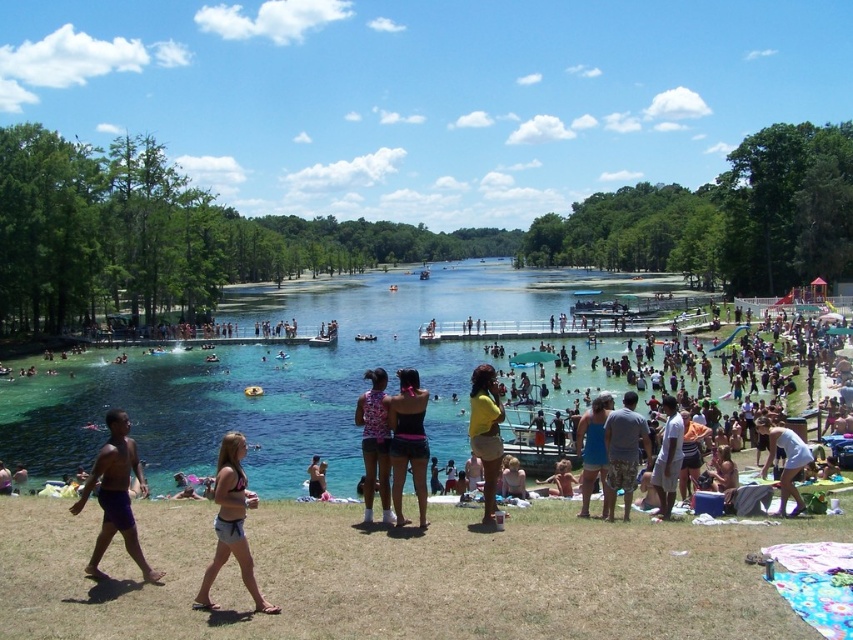
You are standing at the edge of the lake and see two points in the water. The first point is at coordinates point (401, 480) and the second is at point (595, 465). Which point is closer to you?

Point (401, 480) is closer to the viewer than point (595, 465).

From the picture: You are standing on the grassy area in the foreground of the swimming area and want to find the black swimsuit at center. According to the coordinates provided, in which direction should you look to locate it?

The black swimsuit at center is located at point coordinates, so you should look towards the center area of the image to find it.

You are a photographer at the swimming area and need to capture both the black swimsuit at center and the blue fabric dress at center in a single frame. Which object should you focus on to ensure both are visible without zooming in too much?

You should focus on the black swimsuit at center because it occupies less space than the blue fabric dress at center, allowing both to fit within the frame without excessive zooming.